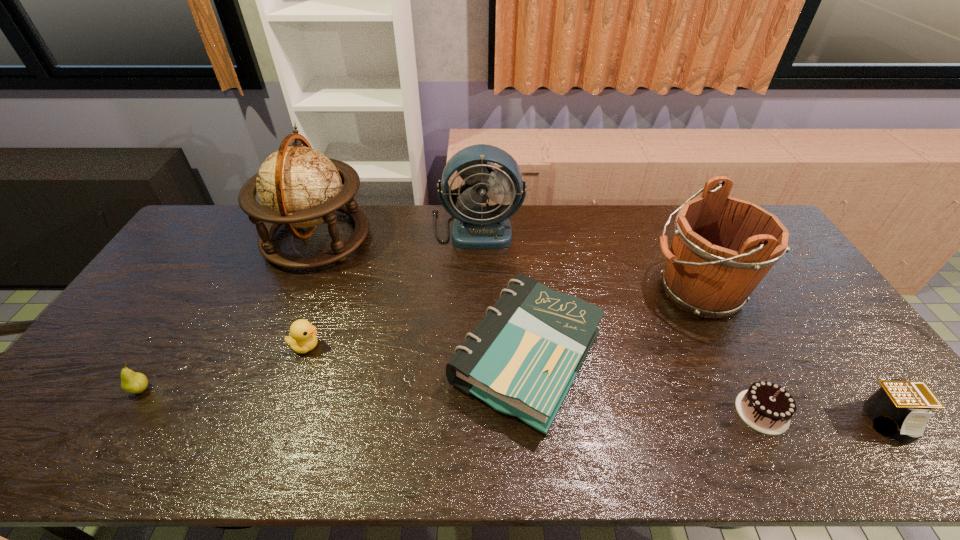
The width and height of the screenshot is (960, 540). I want to click on free area in between the duck and the globe, so click(x=311, y=292).

Where is `free point between the duck and the rightmost object`? This screenshot has width=960, height=540. free point between the duck and the rightmost object is located at coordinates (597, 383).

Find the location of a particular element. The image size is (960, 540). free spot between the chocolate cake and the bucket is located at coordinates [x=730, y=352].

Identify which object is the seventh closest to the pear. Please provide its 2D coordinates. Your answer should be formatted as a tuple, i.e. [(x, y)], where the tuple contains the x and y coordinates of a point satisfying the conditions above.

[(899, 408)]

Find the location of a particular element. The image size is (960, 540). the closest object to the duck is located at coordinates (298, 186).

In order to click on free space that satisfies the following two spatial constraints: 1. with the handle on the side of the chocolate cake; 2. on the right side of the bucket in this screenshot , I will do `click(756, 411)`.

Locate an element on the screen. This screenshot has width=960, height=540. free region that satisfies the following two spatial constraints: 1. on the front side of the calculator; 2. on the right side of the chocolate cake is located at coordinates (766, 420).

The height and width of the screenshot is (540, 960). What are the coordinates of `free point that satisfies the following two spatial constraints: 1. in front of the fan to blow air; 2. on the face of the duck` in the screenshot? It's located at (475, 346).

Identify the location of blank area in the image that satisfies the following two spatial constraints: 1. with the handle on the side of the bucket; 2. on the right side of the chocolate cake. The image size is (960, 540). (756, 411).

Image resolution: width=960 pixels, height=540 pixels. In order to click on vacant region that satisfies the following two spatial constraints: 1. in front of the fan to blow air; 2. on the right side of the paperback book in this screenshot , I will do pyautogui.click(x=475, y=357).